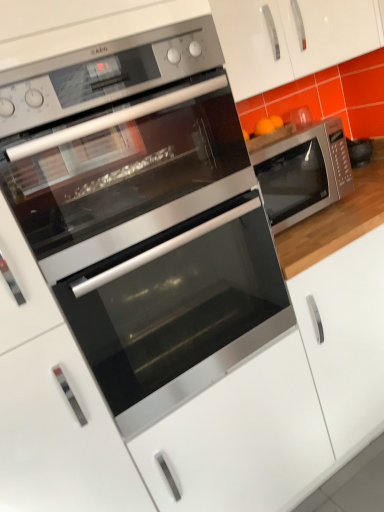
Question: From a real-world perspective, is stainless steel microwave at right, placed as the 1th microwave oven when sorted from front to back, above or below satin white drawer at center, which is the 1th drawer in right-to-left order?

Choices:
 (A) above
 (B) below

Answer: (A)

Question: Does point (157, 216) appear closer or farther from the camera than point (322, 440)?

Choices:
 (A) farther
 (B) closer

Answer: (B)

Question: Which object is the farthest from the stainless steel microwave at right, marked as the 2th microwave oven in a left-to-right arrangement?

Choices:
 (A) satin silver oven at center
 (B) satin white drawer at center, which is the 1th drawer in right-to-left order
 (C) stainless steel microwave at right, placed as the 1th microwave oven when sorted from front to back
 (D) satin silver drawer at center, which is the 2th drawer in right-to-left order
 (E) white glossy cabinet at upper center

Answer: (D)

Question: Estimate the real-world distances between objects in this image. Which object is closer to the white glossy cabinet at upper center?

Choices:
 (A) satin silver drawer at center, placed as the 1th drawer when sorted from left to right
 (B) satin silver oven at center
 (C) stainless steel microwave at right, the second microwave oven when ordered from back to front
 (D) satin white drawer at center, which is the 1th drawer in right-to-left order
 (E) stainless steel microwave at right, the first microwave oven viewed from the back

Answer: (E)